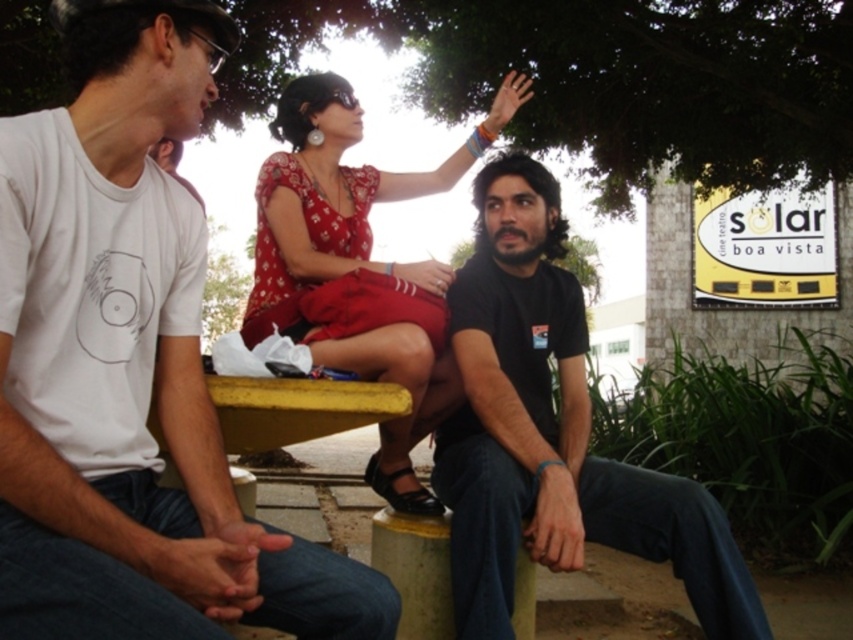
Is white matte t-shirt at left wider than black matte shirt at center?

Yes.

Is white matte t-shirt at left thinner than black matte shirt at center?

No, white matte t-shirt at left is not thinner than black matte shirt at center.

The image size is (853, 640). Find the location of `white matte t-shirt at left`. white matte t-shirt at left is located at coordinates coord(131,365).

Consider the image. Who is shorter, white matte t-shirt at left or matte red dress at center?

Result: Standing shorter between the two is white matte t-shirt at left.

Can you confirm if white matte t-shirt at left is shorter than matte red dress at center?

Yes, white matte t-shirt at left is shorter than matte red dress at center.

Is point (7, 289) positioned after point (456, 173)?

No, (7, 289) is in front of (456, 173).

At what (x,y) coordinates should I click in order to perform the action: click on white matte t-shirt at left. Please return your answer as a coordinate pair (x, y). The width and height of the screenshot is (853, 640). Looking at the image, I should click on (131, 365).

Can you confirm if black matte shirt at center is shorter than matte red dress at center?

Correct, black matte shirt at center is not as tall as matte red dress at center.

Looking at this image, can you confirm if black matte shirt at center is wider than matte red dress at center?

Incorrect, black matte shirt at center's width does not surpass matte red dress at center's.

Is point (579, 372) positioned after point (519, 97)?

No.

This screenshot has height=640, width=853. Find the location of `black matte shirt at center`. black matte shirt at center is located at coordinates (552, 433).